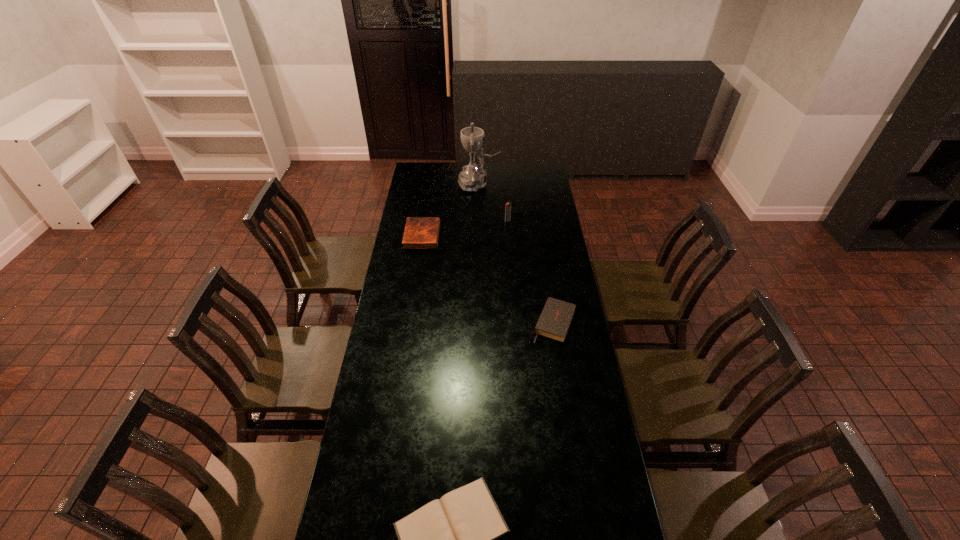
The width and height of the screenshot is (960, 540). Find the location of `free area in between the farthest object and the third nearest object`. free area in between the farthest object and the third nearest object is located at coordinates (450, 210).

Identify the location of unoccupied position between the fourth nearest object and the farthest object. (493, 202).

This screenshot has height=540, width=960. Find the location of `vacant space that is in between the second tallest object and the rightmost Bible`. vacant space that is in between the second tallest object and the rightmost Bible is located at coordinates (531, 272).

Choose which object is the second nearest neighbor to the fourth nearest object. Please provide its 2D coordinates. Your answer should be formatted as a tuple, i.e. [(x, y)], where the tuple contains the x and y coordinates of a point satisfying the conditions above.

[(420, 232)]

Point out which object is positioned as the second nearest to the nearest object. Please provide its 2D coordinates. Your answer should be formatted as a tuple, i.e. [(x, y)], where the tuple contains the x and y coordinates of a point satisfying the conditions above.

[(420, 232)]

Select which Bible appears as the closest to the shortest Bible. Please provide its 2D coordinates. Your answer should be formatted as a tuple, i.e. [(x, y)], where the tuple contains the x and y coordinates of a point satisfying the conditions above.

[(555, 319)]

Identify which Bible is the closest to the farthest Bible. Please provide its 2D coordinates. Your answer should be formatted as a tuple, i.e. [(x, y)], where the tuple contains the x and y coordinates of a point satisfying the conditions above.

[(555, 319)]

Identify the location of free point that satisfies the following two spatial constraints: 1. on the spine side of the third farthest object; 2. on the left side of the second farthest Bible. 409,322.

Find the location of a particular element. The image size is (960, 540). free space that satisfies the following two spatial constraints: 1. on the front side of the fourth object from left to right; 2. on the spine side of the third nearest object is located at coordinates (509, 235).

Find the location of `free space that satisfies the following two spatial constraints: 1. on the side with emblem of the second farthest object; 2. on the left side of the award`. free space that satisfies the following two spatial constraints: 1. on the side with emblem of the second farthest object; 2. on the left side of the award is located at coordinates (478, 221).